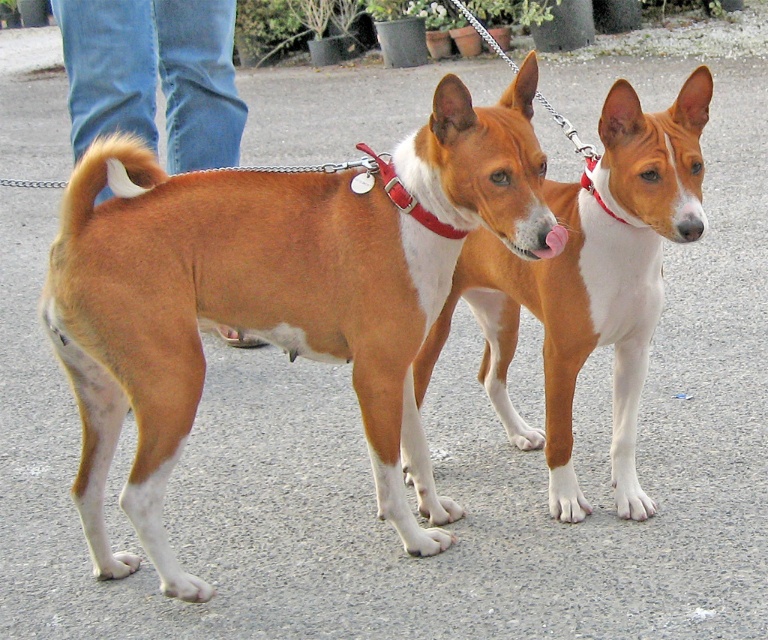
Question: Which is nearer to the brown fur tail at lower left?

Choices:
 (A) brown/white fur at center
 (B) brown smooth dog at center
 (C) red leather collar at center

Answer: (C)

Question: Which is nearer to the red nylon collar at center?

Choices:
 (A) red leather collar at center
 (B) brown fur tail at lower left
 (C) brown/white fur at center
 (D) brown smooth dog at center

Answer: (A)

Question: Can you confirm if brown fur tail at lower left is wider than red nylon collar at center?

Choices:
 (A) no
 (B) yes

Answer: (B)

Question: Which of these objects is positioned closest to the red leather collar at center?

Choices:
 (A) brown smooth dog at center
 (B) brown fur tail at left
 (C) brown fur tail at lower left

Answer: (B)

Question: Does brown/white fur at center have a lesser width compared to brown fur tail at lower left?

Choices:
 (A) yes
 (B) no

Answer: (B)

Question: From the image, what is the correct spatial relationship of brown smooth dog at center in relation to brown fur tail at left?

Choices:
 (A) left
 (B) right

Answer: (B)